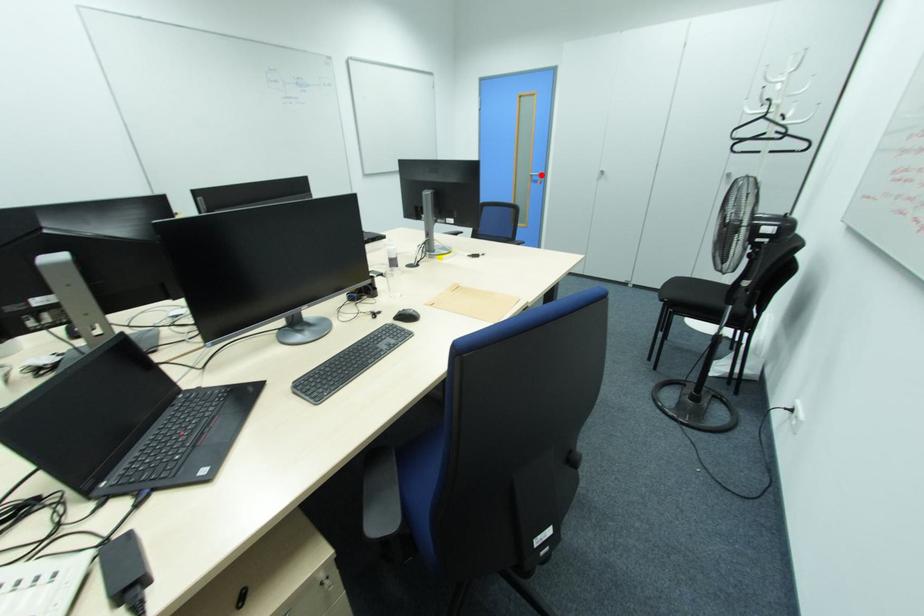
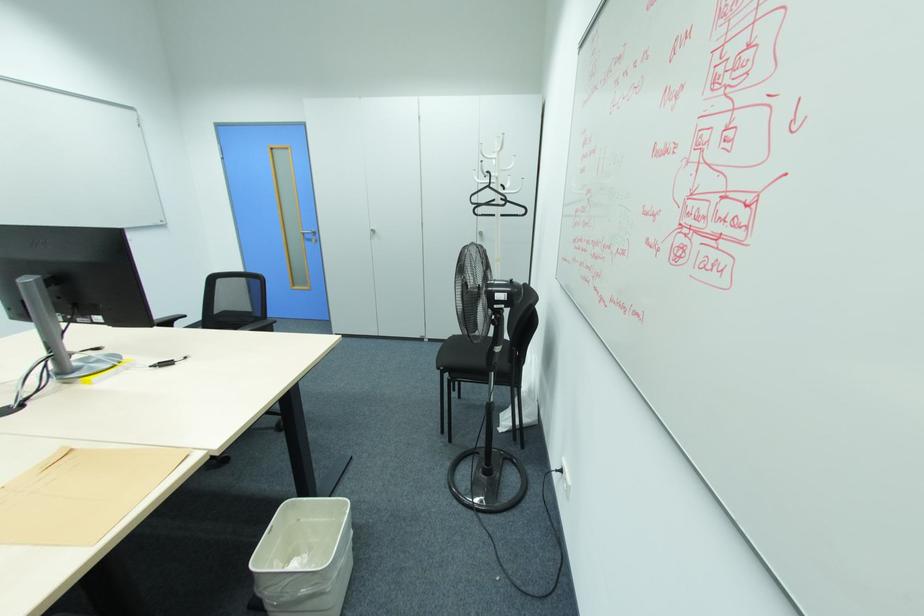
The point at the highlighted location is marked in the first image. Where is the corresponding point in the second image?

(314, 233)